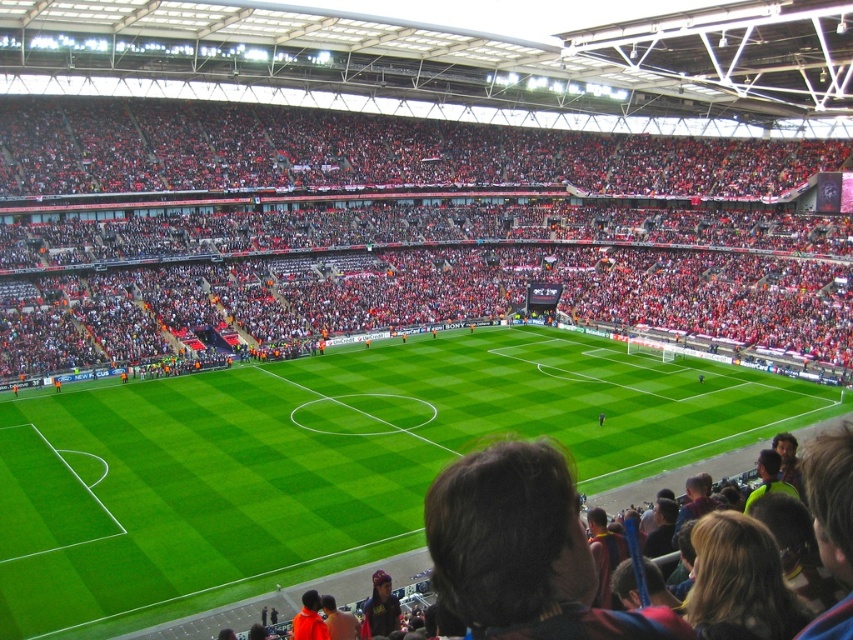
Question: Does red fabric seats at center lie in front of green grass football field at center?

Choices:
 (A) yes
 (B) no

Answer: (B)

Question: Is red fabric seats at center below green grass football field at center?

Choices:
 (A) yes
 (B) no

Answer: (B)

Question: Which object is closer to the camera taking this photo?

Choices:
 (A) red fabric seats at center
 (B) green grass football field at center

Answer: (B)

Question: Does red fabric seats at center lie behind green grass football field at center?

Choices:
 (A) yes
 (B) no

Answer: (A)